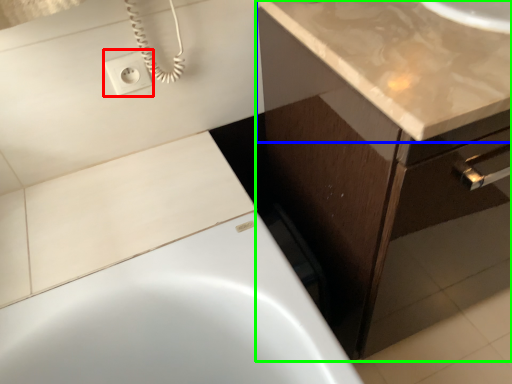
Question: Based on their relative distances, which object is farther from electric outlet (highlighted by a red box)? Choose from countertop (highlighted by a blue box) and bathroom cabinet (highlighted by a green box).

Choices:
 (A) countertop
 (B) bathroom cabinet

Answer: (B)